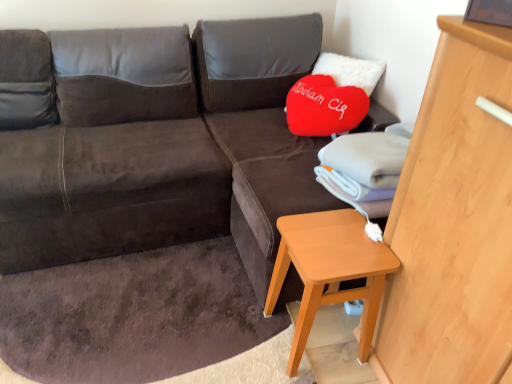
Question: Can you confirm if suede-like brown bean bag at left is shorter than orange wood side table at lower right?

Choices:
 (A) no
 (B) yes

Answer: (A)

Question: From the image's perspective, is suede-like brown bean bag at left beneath orange wood side table at lower right?

Choices:
 (A) yes
 (B) no

Answer: (B)

Question: Considering the relative positions of suede-like brown bean bag at left and orange wood side table at lower right in the image provided, is suede-like brown bean bag at left to the right of orange wood side table at lower right from the viewer's perspective?

Choices:
 (A) no
 (B) yes

Answer: (A)

Question: Is suede-like brown bean bag at left positioned beyond the bounds of orange wood side table at lower right?

Choices:
 (A) yes
 (B) no

Answer: (A)

Question: From a real-world perspective, does suede-like brown bean bag at left stand above orange wood side table at lower right?

Choices:
 (A) yes
 (B) no

Answer: (A)

Question: Is suede-like brown bean bag at left closer to camera compared to orange wood side table at lower right?

Choices:
 (A) yes
 (B) no

Answer: (B)

Question: Can you confirm if light wood dresser at right is smaller than suede-like brown bean bag at left?

Choices:
 (A) no
 (B) yes

Answer: (B)

Question: Can you confirm if light wood dresser at right is shorter than suede-like brown bean bag at left?

Choices:
 (A) no
 (B) yes

Answer: (A)

Question: Is light wood dresser at right outside of suede-like brown bean bag at left?

Choices:
 (A) yes
 (B) no

Answer: (A)

Question: From a real-world perspective, does light wood dresser at right stand above suede-like brown bean bag at left?

Choices:
 (A) no
 (B) yes

Answer: (B)

Question: Considering the relative sizes of light wood dresser at right and suede-like brown bean bag at left in the image provided, is light wood dresser at right wider than suede-like brown bean bag at left?

Choices:
 (A) no
 (B) yes

Answer: (A)

Question: From the image's perspective, is light wood dresser at right beneath suede-like brown bean bag at left?

Choices:
 (A) no
 (B) yes

Answer: (B)

Question: From the image's perspective, would you say light wood dresser at right is shown under dark brown fabric couch at center?

Choices:
 (A) no
 (B) yes

Answer: (B)